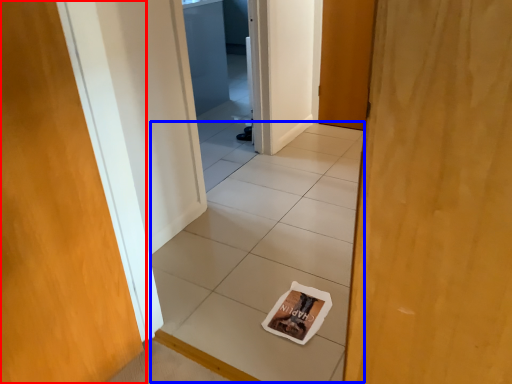
Question: Which point is further to the camera, door (highlighted by a red box) or tile (highlighted by a blue box)?

Choices:
 (A) door
 (B) tile

Answer: (B)